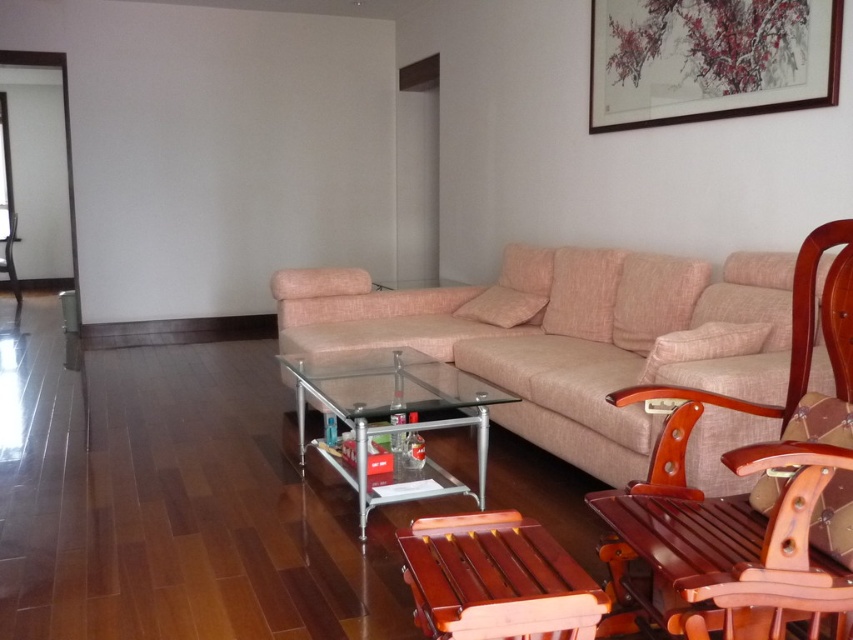
Does mahogany wood rocking chair at center come in front of transparent glass coffee table at center?

Yes, mahogany wood rocking chair at center is closer to the viewer.

You are a GUI agent. You are given a task and a screenshot of the screen. Output one action in this format:
    pyautogui.click(x=<x>, y=<y>)
    Task: Click on the mahogany wood rocking chair at center
    The height and width of the screenshot is (640, 853).
    Given the screenshot: What is the action you would take?
    pyautogui.click(x=756, y=493)

Between point (480, 493) and point (9, 252), which one is positioned in front?

Point (480, 493) is more forward.

Can you confirm if transparent glass coffee table at center is wider than brown wooden chair at center?

Indeed, transparent glass coffee table at center has a greater width compared to brown wooden chair at center.

Between point (381, 486) and point (0, 272), which one is positioned in front?

Point (381, 486) is in front.

Where is `transparent glass coffee table at center`? This screenshot has width=853, height=640. transparent glass coffee table at center is located at coordinates (390, 419).

From the picture: Is wooden picture frame at upper right thinner than transparent glass coffee table at center?

Indeed, wooden picture frame at upper right has a lesser width compared to transparent glass coffee table at center.

The width and height of the screenshot is (853, 640). What do you see at coordinates (709, 58) in the screenshot?
I see `wooden picture frame at upper right` at bounding box center [709, 58].

Find the location of a particular element. The width and height of the screenshot is (853, 640). wooden picture frame at upper right is located at coordinates (709, 58).